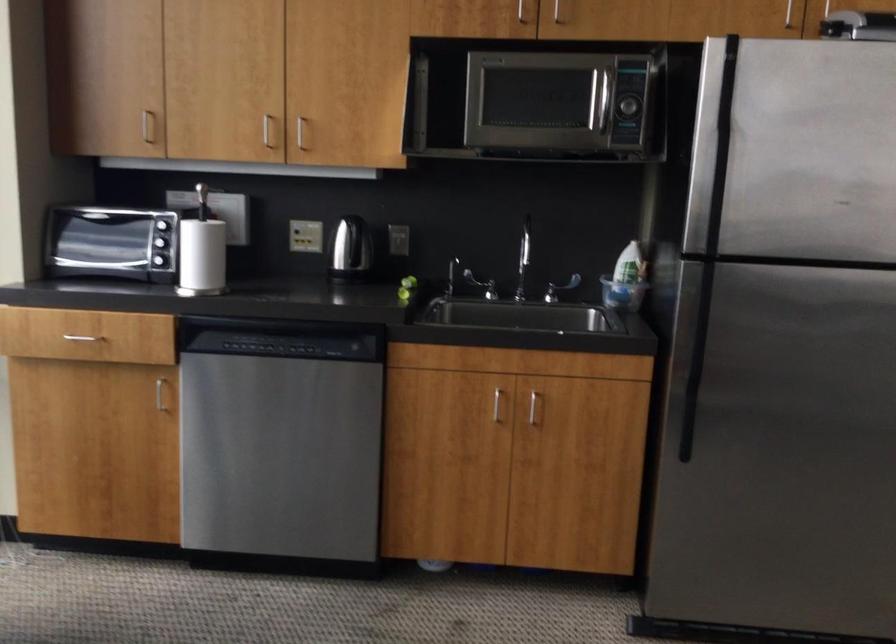
The height and width of the screenshot is (644, 896). Describe the element at coordinates (480, 285) in the screenshot. I see `the silver faucet handle` at that location.